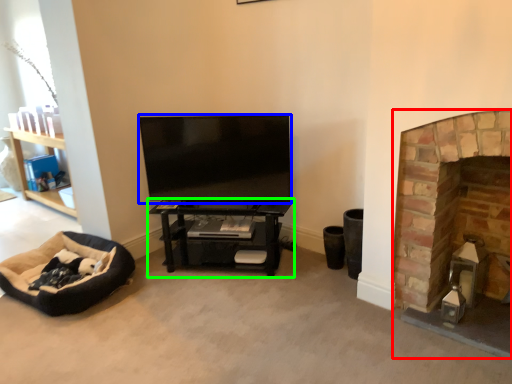
Question: Based on their relative distances, which object is farther from fireplace (highlighted by a red box)? Choose from television (highlighted by a blue box) and shelf (highlighted by a green box).

Choices:
 (A) television
 (B) shelf

Answer: (A)